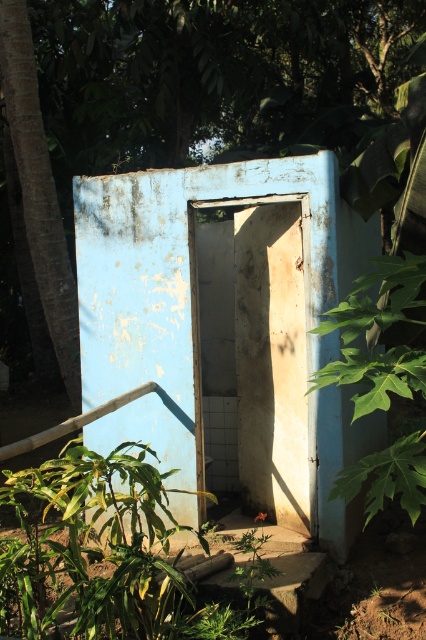
You are a painter who needs to decide which object to paint first. The white matte door at center and the green leafy plant at right are both in your view. Which object is narrower?

The white matte door at center has a lesser width compared to the green leafy plant at right, so the white matte door at center is narrower.

You are standing in front of a small outdoor toilet structure. You see a white matte door at center and a green leafy plant at right. Which object is located more to the left?

The white matte door at center is positioned on the left side of green leafy plant at right, so it is more to the left.